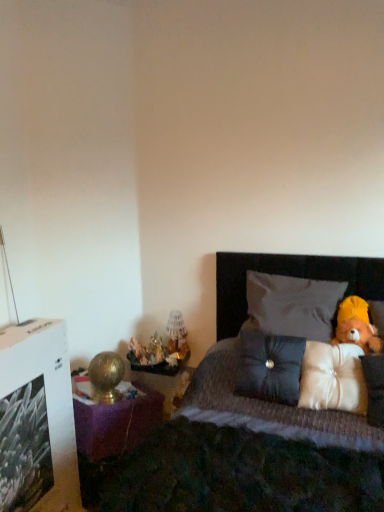
The width and height of the screenshot is (384, 512). Find the location of `metallic gold figurines at left`. metallic gold figurines at left is located at coordinates (147, 352).

The image size is (384, 512). What do you see at coordinates (356, 326) in the screenshot?
I see `yellow plush teddy bear at right` at bounding box center [356, 326].

What do you see at coordinates (177, 336) in the screenshot?
I see `matte glass table lamp at center` at bounding box center [177, 336].

Where is `white fabric pillow at upper right, which is the 3th pillow in bottom-to-top order`? The image size is (384, 512). white fabric pillow at upper right, which is the 3th pillow in bottom-to-top order is located at coordinates (293, 305).

How different are the orientations of matte glass table lamp at center and satin dark gray pillow at center, the 2th pillow from the bottom, in degrees?

There is a 1.36-degree angle between the facing directions of matte glass table lamp at center and satin dark gray pillow at center, the 2th pillow from the bottom.

Is matte glass table lamp at center far away from satin dark gray pillow at center, the second pillow when ordered from top to bottom?

→ No, there isn't a large distance between matte glass table lamp at center and satin dark gray pillow at center, the second pillow when ordered from top to bottom.

At what (x,y) coordinates should I click in order to perform the action: click on table lamp above the satin dark gray pillow at center, the second pillow when ordered from top to bottom (from the image's perspective). Please return your answer as a coordinate pair (x, y). Looking at the image, I should click on (177, 336).

Is matte glass table lamp at center looking in the opposite direction of satin dark gray pillow at center, the 2th pillow from the bottom?

matte glass table lamp at center does not have its back to satin dark gray pillow at center, the 2th pillow from the bottom.

Based on the photo, between white fabric pillow at upper right, the 1th pillow viewed from the top, and yellow plush teddy bear at right, which one appears on the left side from the viewer's perspective?

From the viewer's perspective, white fabric pillow at upper right, the 1th pillow viewed from the top, appears more on the left side.

Is white fabric pillow at upper right, the 1th pillow viewed from the top, situated inside yellow plush teddy bear at right or outside?

white fabric pillow at upper right, the 1th pillow viewed from the top, is not enclosed by yellow plush teddy bear at right.

Is white fabric pillow at upper right, which is the 3th pillow in bottom-to-top order, positioned far away from yellow plush teddy bear at right?

white fabric pillow at upper right, which is the 3th pillow in bottom-to-top order, is actually quite close to yellow plush teddy bear at right.

You are a GUI agent. You are given a task and a screenshot of the screen. Output one action in this format:
    pyautogui.click(x=<x>, y=<y>)
    Task: Click on the table lamp above the matte gold figurine at left (from a real-world perspective)
    
    Given the screenshot: What is the action you would take?
    pyautogui.click(x=177, y=336)

Can you confirm if matte glass table lamp at center is taller than matte gold figurine at left?

Indeed, matte glass table lamp at center has a greater height compared to matte gold figurine at left.

Can you tell me how much matte glass table lamp at center and matte gold figurine at left differ in facing direction?

There is a 82.5-degree angle between the facing directions of matte glass table lamp at center and matte gold figurine at left.

Is metallic gold figurines at left aimed at matte gold figurine at left?

No.

Can you confirm if metallic gold figurines at left is shorter than matte gold figurine at left?

Correct, metallic gold figurines at left is not as tall as matte gold figurine at left.

Is metallic gold figurines at left not near matte gold figurine at left?

metallic gold figurines at left is near matte gold figurine at left, not far away.

From the image's perspective, is metallic gold figurines at left positioned above or below matte gold figurine at left?

metallic gold figurines at left is below matte gold figurine at left.

Between satin dark gray pillow at center, the 2th pillow from the bottom, and yellow plush teddy bear at right, which one has less height?

yellow plush teddy bear at right.

Which of these two, satin dark gray pillow at center, the 2th pillow from the bottom, or yellow plush teddy bear at right, is wider?

satin dark gray pillow at center, the 2th pillow from the bottom.

Is point (247, 343) in front of point (342, 326)?

Yes, it is.

In the scene shown: Is satin dark gray pillow at center, the second pillow when ordered from top to bottom, positioned with its back to yellow plush teddy bear at right?

No.

From the picture: Can you see white fabric pillow at upper right, which is the 3th pillow in bottom-to-top order, touching matte glass table lamp at center?

No, white fabric pillow at upper right, which is the 3th pillow in bottom-to-top order, is not beside matte glass table lamp at center.

You are a GUI agent. You are given a task and a screenshot of the screen. Output one action in this format:
    pyautogui.click(x=<x>, y=<y>)
    Task: Click on the table lamp below the white fabric pillow at upper right, which is the 3th pillow in bottom-to-top order (from a real-world perspective)
    Image resolution: width=384 pixels, height=512 pixels.
    Given the screenshot: What is the action you would take?
    pyautogui.click(x=177, y=336)

From a real-world perspective, between white fabric pillow at upper right, the 1th pillow viewed from the top, and matte glass table lamp at center, who is vertically lower?

matte glass table lamp at center.

Is matte glass table lamp at center inside white fabric pillow at upper right, which is the 3th pillow in bottom-to-top order?

No, matte glass table lamp at center is not surrounded by white fabric pillow at upper right, which is the 3th pillow in bottom-to-top order.

Which is more to the right, yellow plush teddy bear at right or dark fabric bed at right?

Positioned to the right is yellow plush teddy bear at right.

Is there a large distance between yellow plush teddy bear at right and dark fabric bed at right?

No.

Which of these two, yellow plush teddy bear at right or dark fabric bed at right, stands taller?

dark fabric bed at right.

Which is in front, yellow plush teddy bear at right or dark fabric bed at right?

dark fabric bed at right is in front.

Where is `table lamp above the satin dark gray pillow at center, the second pillow when ordered from top to bottom (from the image's perspective)`? This screenshot has height=512, width=384. table lamp above the satin dark gray pillow at center, the second pillow when ordered from top to bottom (from the image's perspective) is located at coordinates (177, 336).

You are a GUI agent. You are given a task and a screenshot of the screen. Output one action in this format:
    pyautogui.click(x=<x>, y=<y>)
    Task: Click on the teddy bear in front of the white fabric pillow at upper right, the 1th pillow viewed from the top
    The image size is (384, 512).
    Given the screenshot: What is the action you would take?
    pyautogui.click(x=356, y=326)

Estimate the real-world distances between objects in this image. Which object is closer to metallic gold figurines at left, dark fabric bed at right or satin dark gray pillow at center, the second pillow when ordered from top to bottom?

Among the two, satin dark gray pillow at center, the second pillow when ordered from top to bottom, is located nearer to metallic gold figurines at left.

Based on their spatial positions, is satin white pillow at right, which ranks as the 1th pillow in bottom-to-top order, or dark fabric bed at right further from satin dark gray pillow at center, the 2th pillow from the bottom?

dark fabric bed at right lies further to satin dark gray pillow at center, the 2th pillow from the bottom, than the other object.

From the image, which object appears to be nearer to yellow plush teddy bear at right, metallic gold figurines at left or dark fabric bed at right?

Based on the image, dark fabric bed at right appears to be nearer to yellow plush teddy bear at right.

Considering their positions, is white fabric pillow at upper right, which is the 3th pillow in bottom-to-top order, positioned further to satin dark gray pillow at center, the 2th pillow from the bottom, than matte gold figurine at left?

Based on the image, matte gold figurine at left appears to be further to satin dark gray pillow at center, the 2th pillow from the bottom.

When comparing their distances from yellow plush teddy bear at right, does metallic gold figurines at left or white fabric pillow at upper right, which is the 3th pillow in bottom-to-top order, seem closer?

white fabric pillow at upper right, which is the 3th pillow in bottom-to-top order, is positioned closer to the anchor yellow plush teddy bear at right.

Which object lies further to the anchor point matte gold figurine at left, metallic gold figurines at left or satin dark gray pillow at center, the 2th pillow from the bottom?

satin dark gray pillow at center, the 2th pillow from the bottom, is further to matte gold figurine at left.

Which object lies nearer to the anchor point dark fabric bed at right, white fabric pillow at upper right, the 1th pillow viewed from the top, or matte glass table lamp at center?

white fabric pillow at upper right, the 1th pillow viewed from the top.

When comparing their distances from dark fabric bed at right, does matte gold figurine at left or yellow plush teddy bear at right seem closer?

yellow plush teddy bear at right is closer to dark fabric bed at right.

Locate an element on the screen. This screenshot has width=384, height=512. teddy bear between dark fabric bed at right and metallic gold figurines at left in the front-back direction is located at coordinates (356, 326).

I want to click on stuff between dark fabric bed at right and matte gold figurine at left in the front-back direction, so click(x=147, y=352).

Locate an element on the screen. The width and height of the screenshot is (384, 512). stuff between dark fabric bed at right and matte glass table lamp at center along the z-axis is located at coordinates (147, 352).

Find the location of a particular element. stuff between matte gold figurine at left and yellow plush teddy bear at right is located at coordinates (147, 352).